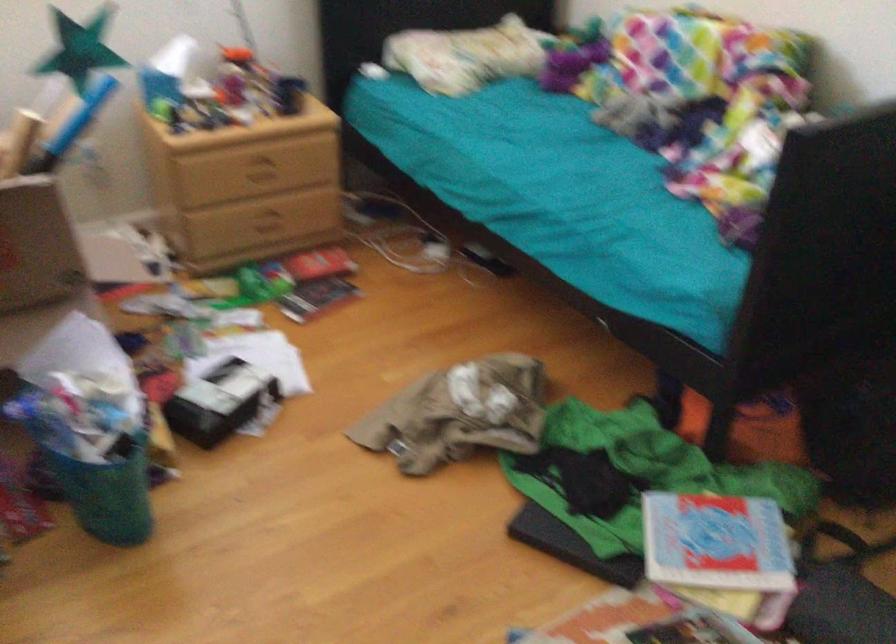
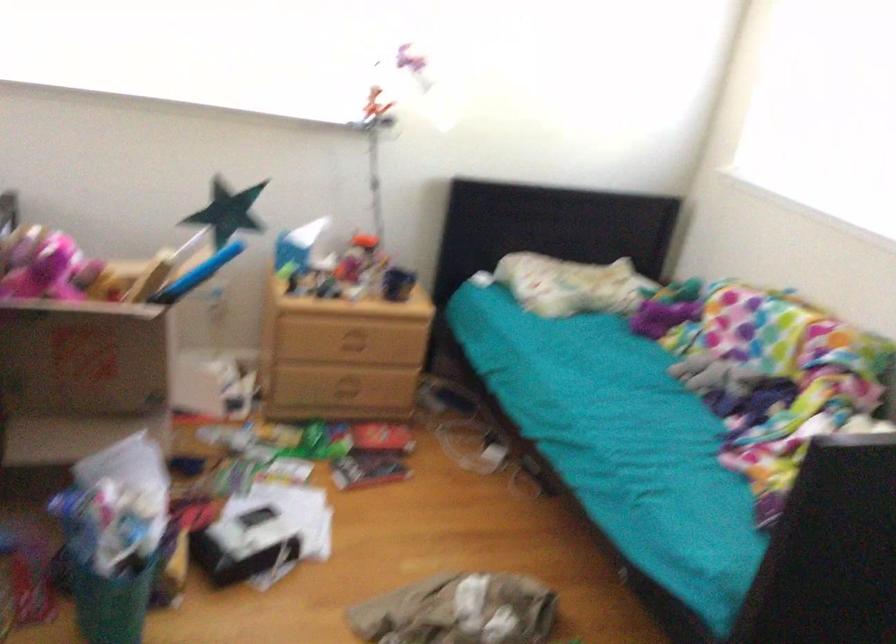
Locate, in the second image, the point that corresponds to (x=260, y=172) in the first image.

(352, 343)